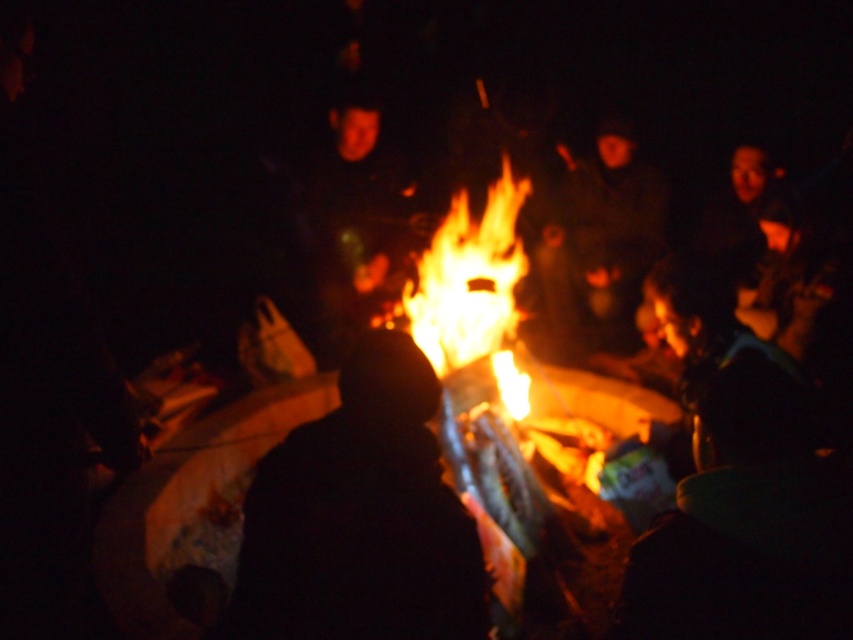
Which is more to the right, black matte person at center or flamematerial/texture at center?

flamematerial/texture at center is more to the right.

Find the location of `black matte person at center`. black matte person at center is located at coordinates (360, 516).

What do you see at coordinates (360, 516) in the screenshot? I see `black matte person at center` at bounding box center [360, 516].

Locate an element on the screen. This screenshot has height=640, width=853. black matte person at center is located at coordinates (360, 516).